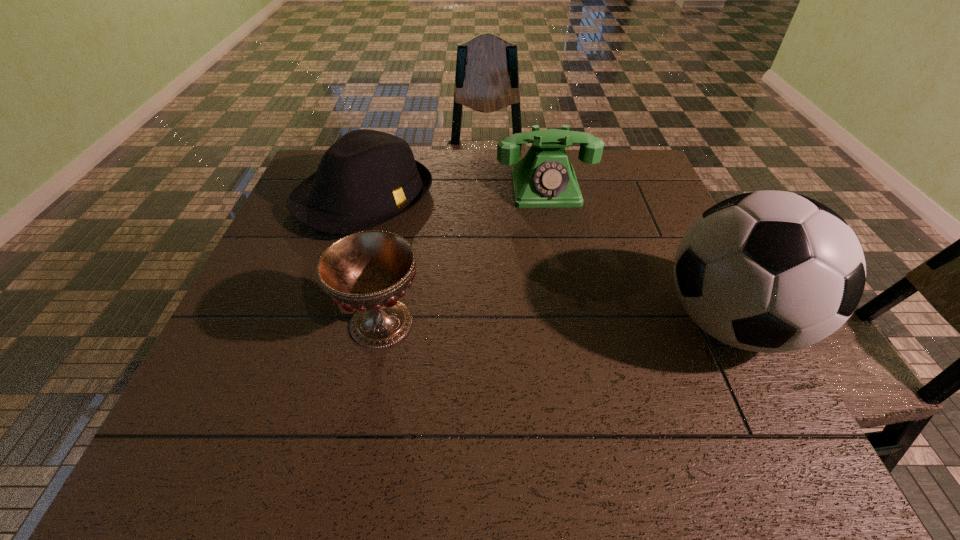
Find the location of a particular element. The image size is (960, 540). free point at the far edge is located at coordinates (435, 164).

At what (x,y) coordinates should I click in order to perform the action: click on blank space at the near edge of the desktop. Please return your answer as a coordinate pair (x, y). This screenshot has width=960, height=540. Looking at the image, I should click on (373, 406).

What are the coordinates of `vacant region at the left edge of the desktop` in the screenshot? It's located at (312, 247).

The width and height of the screenshot is (960, 540). I want to click on free space at the right edge of the desktop, so click(x=620, y=218).

The width and height of the screenshot is (960, 540). In order to click on free spot at the far right corner of the desktop in this screenshot , I will do `click(628, 188)`.

Identify the location of empty space that is in between the tallest object and the fedora. This screenshot has width=960, height=540. (547, 261).

Image resolution: width=960 pixels, height=540 pixels. Find the location of `free space between the rightmost object and the telephone`. free space between the rightmost object and the telephone is located at coordinates (637, 255).

Identify the location of vacant area between the chalice and the telephone. (464, 256).

I want to click on vacant area between the rightmost object and the chalice, so [x=556, y=323].

Where is `vacant point located between the soccer ball and the second object from right to left`? The width and height of the screenshot is (960, 540). vacant point located between the soccer ball and the second object from right to left is located at coordinates (637, 255).